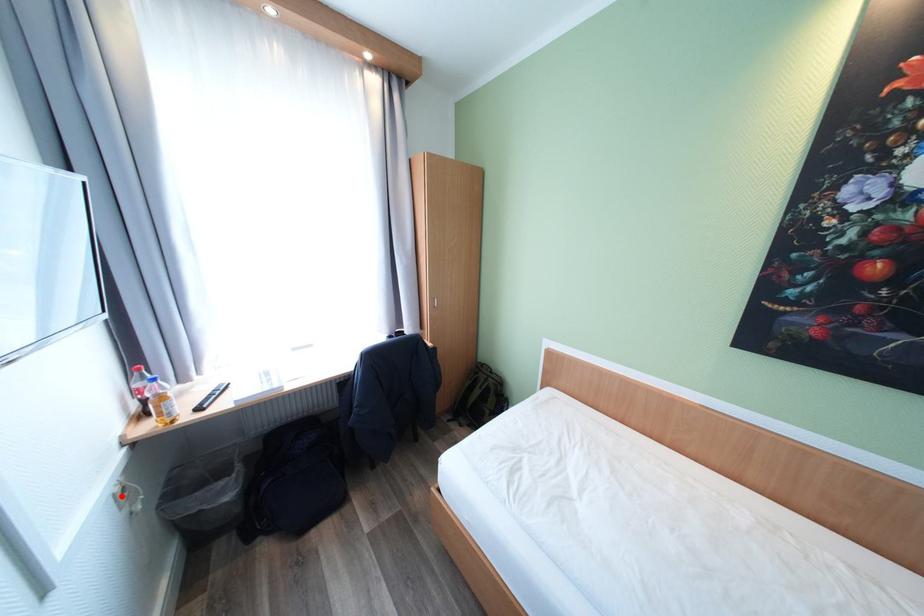
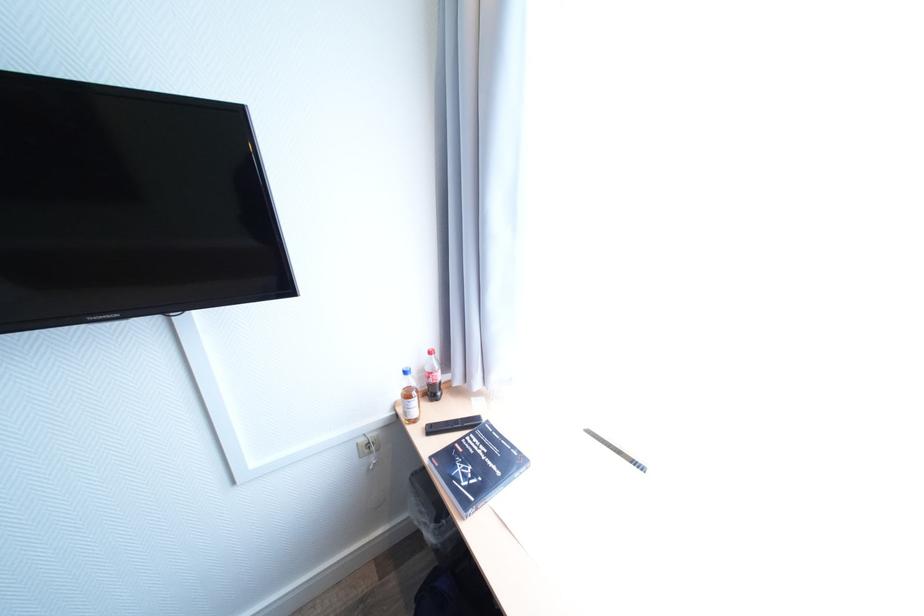
In the second image, find the point that corresponds to the highlighted location in the first image.

(365, 445)